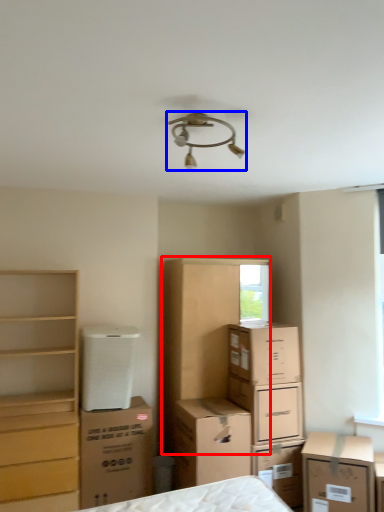
Question: Which point is further to the camera, dresser (highlighted by a red box) or lamp (highlighted by a blue box)?

Choices:
 (A) dresser
 (B) lamp

Answer: (A)